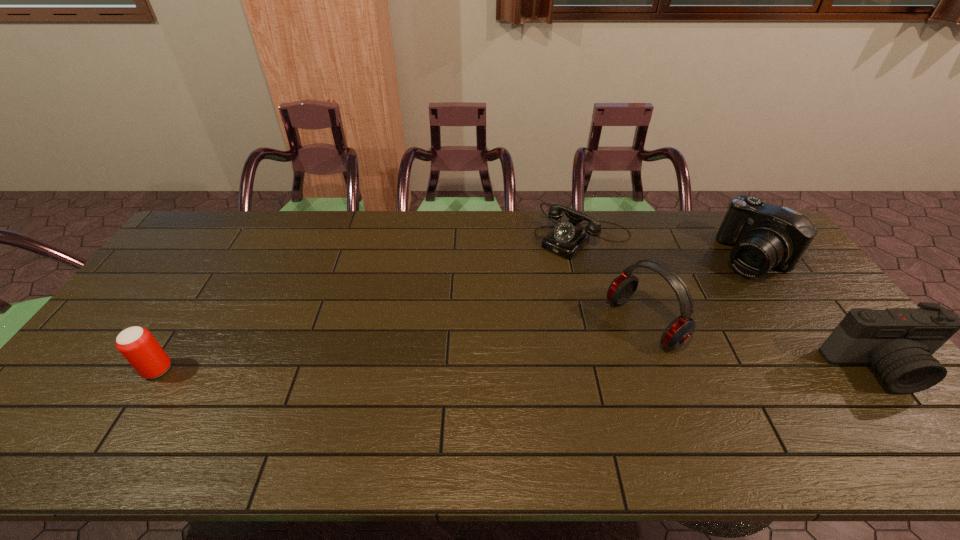
What are the coordinates of `the leftmost object` in the screenshot? It's located at (138, 346).

I want to click on the fourth tallest object, so click(x=138, y=346).

This screenshot has height=540, width=960. What are the coordinates of `the nearer camera` in the screenshot? It's located at (898, 343).

Locate an element on the screen. earphone is located at coordinates (679, 331).

Find the location of a particular element. telephone is located at coordinates (566, 239).

Find the location of `the farther camera`. the farther camera is located at coordinates (765, 236).

Locate an element on the screen. vacant area situated on the back of the beer can is located at coordinates [x=222, y=269].

This screenshot has height=540, width=960. Find the location of `vacant space located on the ear cups of the earphone`. vacant space located on the ear cups of the earphone is located at coordinates tap(548, 383).

I want to click on free space located 0.240m on the ear cups of the earphone, so click(551, 382).

You are a GUI agent. You are given a task and a screenshot of the screen. Output one action in this format:
    pyautogui.click(x=<x>, y=<y>)
    Task: Click on the vacant space located 0.330m on the ear cups of the earphone
    The height and width of the screenshot is (540, 960).
    Given the screenshot: What is the action you would take?
    pyautogui.click(x=522, y=399)